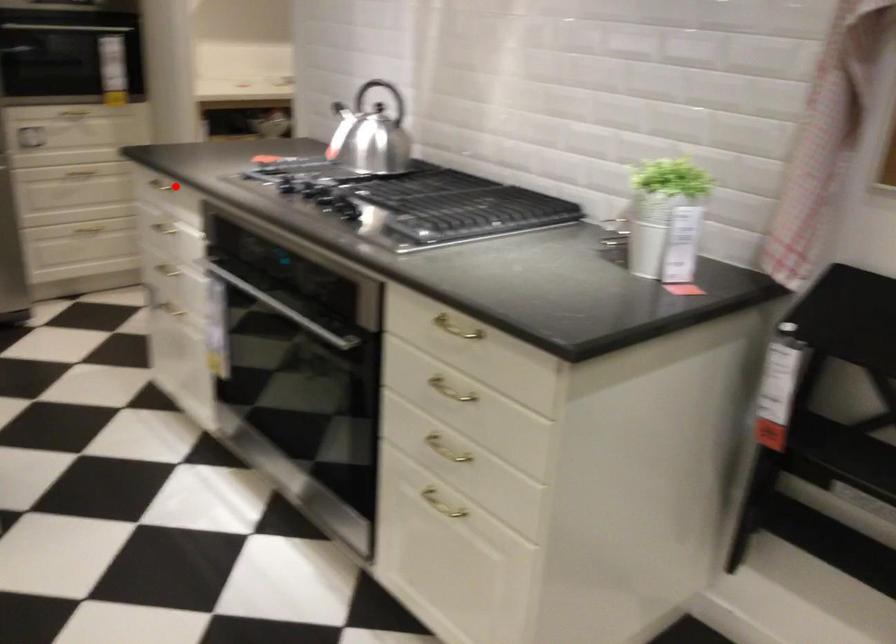
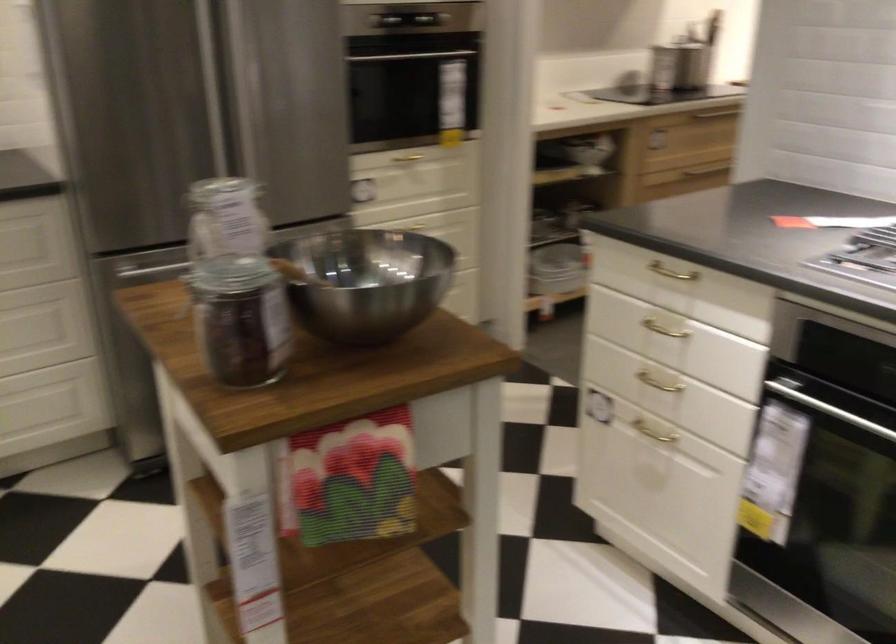
In the second image, find the point that corresponds to the highlighted location in the first image.

(670, 272)